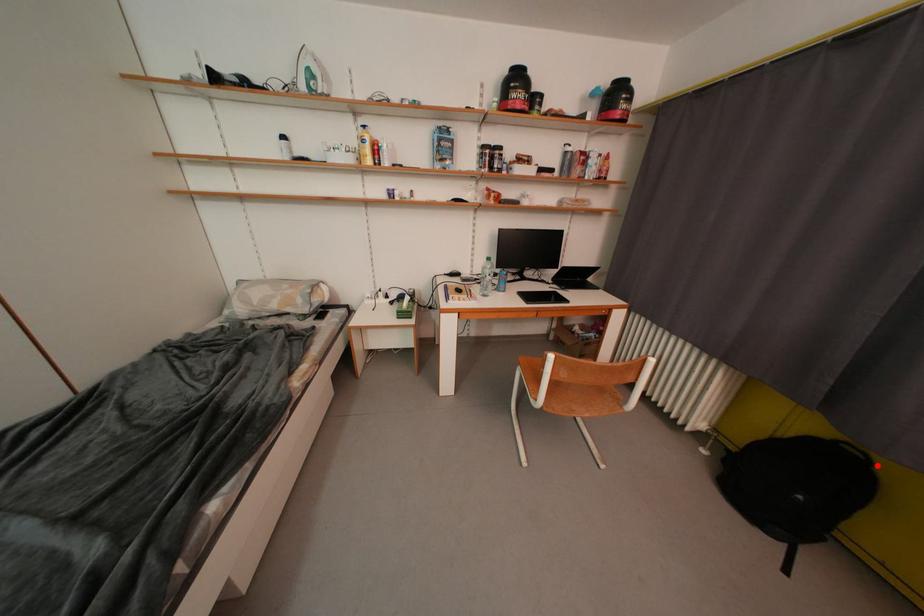
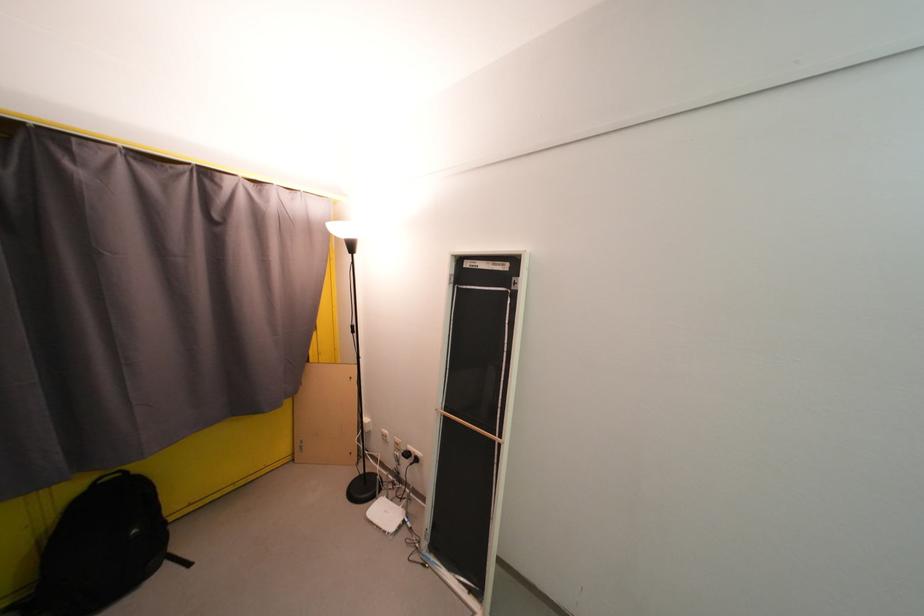
The point at the highlighted location is marked in the first image. Where is the corresponding point in the second image?

(134, 476)